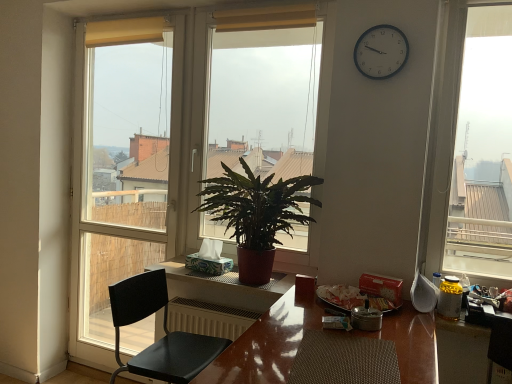
Question: Choose the correct answer: Is yellow fabric curtain at upper center, acting as the 1th curtain starting from the left, inside glossy wooden table at center, acting as the 2th table starting from the back, or outside it?

Choices:
 (A) outside
 (B) inside

Answer: (A)

Question: Looking at their shapes, would you say yellow fabric curtain at upper center, which is counted as the 2th curtain, starting from the right, is wider or thinner than glossy wooden table at center, acting as the 2th table starting from the back?

Choices:
 (A) thin
 (B) wide

Answer: (A)

Question: Estimate the real-world distances between objects in this image. Which object is closer to the glossy wooden table at center, acting as the first table starting from the front?

Choices:
 (A) yellow fabric curtain at upper center, the 1th curtain viewed from the back
 (B) green glossy plant at center
 (C) white plastic clock at upper right
 (D) black matte chair at left
 (E) transparent glass window at left, acting as the 1th window starting from the left

Answer: (D)

Question: Which is nearer to the yellow fabric curtain at upper center, which is the 2th curtain in front-to-back order?

Choices:
 (A) green glossy plant at center
 (B) matte glass window at center, the second window in the left-to-right sequence
 (C) yellow fabric curtain at upper center, which ranks as the first curtain in front-to-back order
 (D) transparent glass window at left, acting as the 2th window starting from the right
 (E) matte brown table at center, marked as the 2th table in a front-to-back arrangement

Answer: (C)